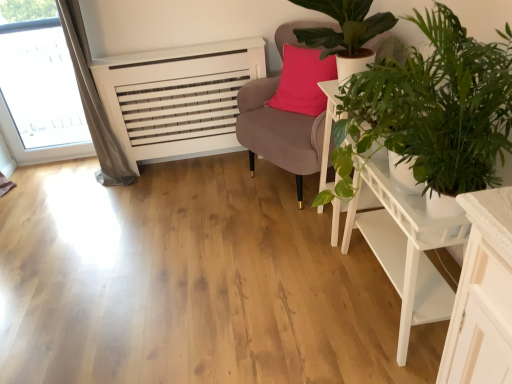
Identify the location of free space between velvet pink chair at upper right and white wooden side table at center right. This screenshot has width=512, height=384. (298, 224).